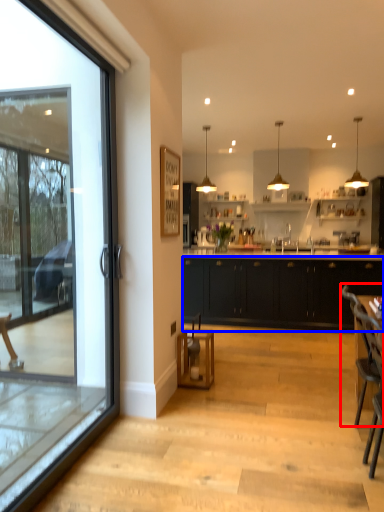
Question: Which of the following is the closest to the observer, armchair (highlighted by a red box) or cabinetry (highlighted by a blue box)?

Choices:
 (A) armchair
 (B) cabinetry

Answer: (A)